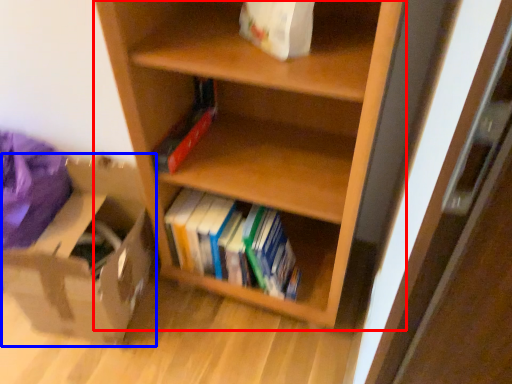
Question: Among these objects, which one is nearest to the camera, shelf (highlighted by a red box) or cardboard box (highlighted by a blue box)?

Choices:
 (A) shelf
 (B) cardboard box

Answer: (A)